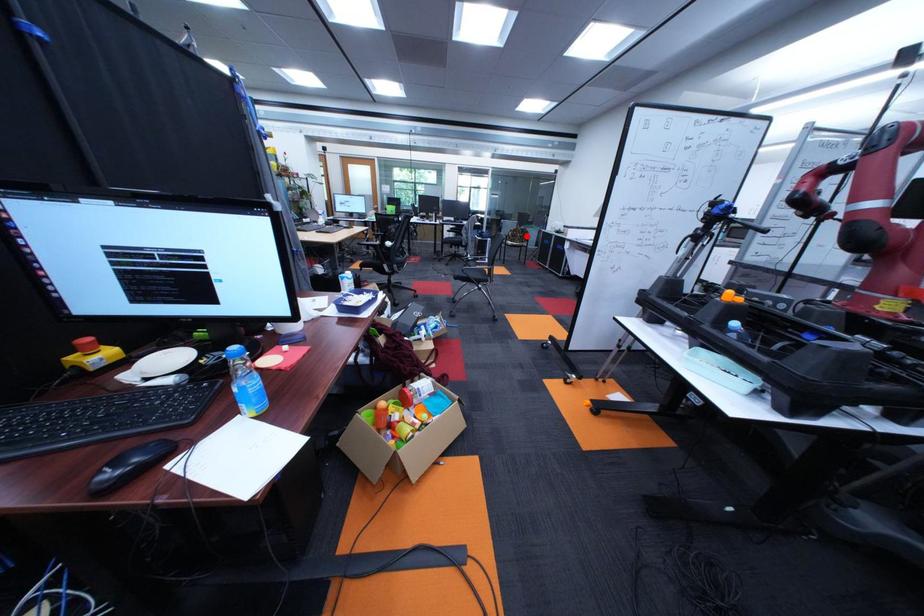
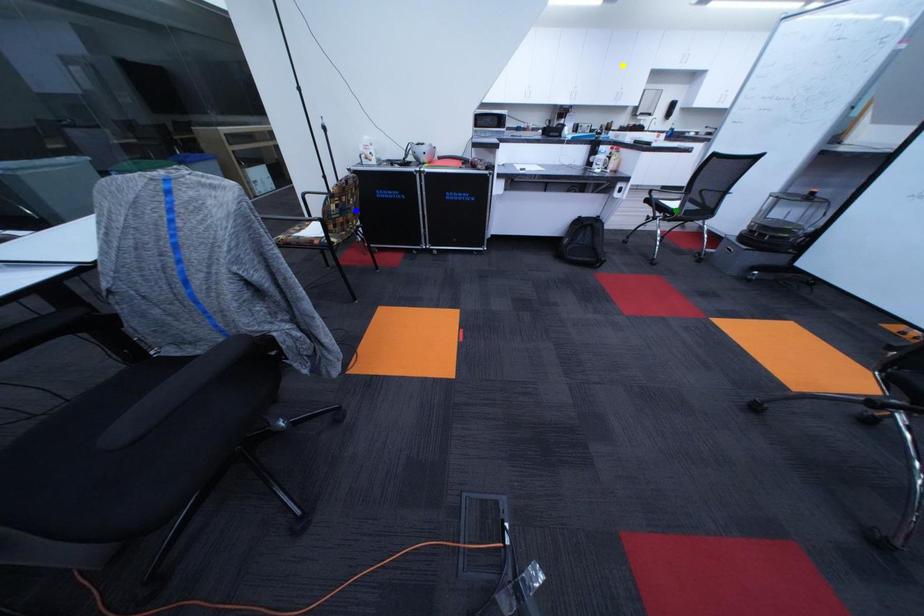
Question: I am providing you with two images of the same scene from different viewpoints. A red point is marked on the first image. You are given multiple points on the second image. Which point in image 2 is actually the same real-world point as the red point in image 1?

Choices:
 (A) yellow point
 (B) green point
 (C) blue point

Answer: (C)